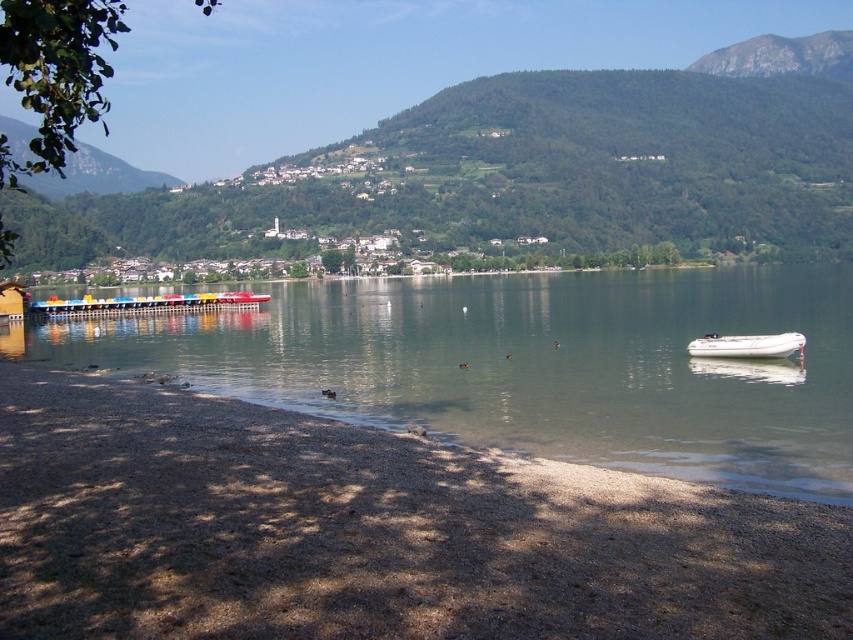
You are planning to cross the lake from the shore where you are standing. You see the clear water at lower left and the white rubber boat at lower right. Which one should you choose to cross the lake?

The white rubber boat at lower right is the correct choice for crossing the lake since it is a boat designed for water travel, while the clear water at lower left is just an area of water and not a vessel.